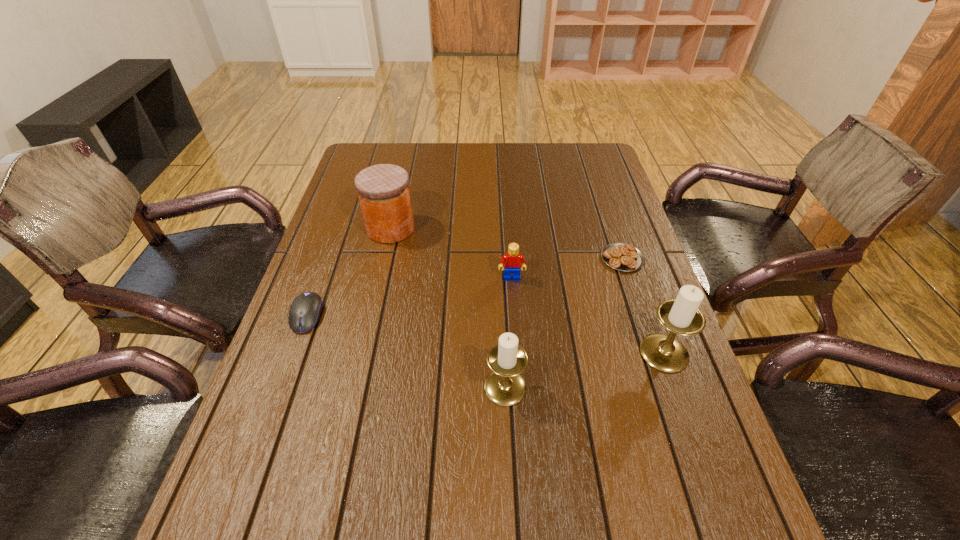
Identify the location of pastry that is at the right edge. Image resolution: width=960 pixels, height=540 pixels. (621, 256).

In the image, there is a desktop. Identify the location of vacant space at the far edge. The width and height of the screenshot is (960, 540). (527, 172).

Find the location of a particular element. This screenshot has width=960, height=540. free space at the left edge of the desktop is located at coordinates (355, 300).

Where is `vacant position at the right edge of the desktop`? The height and width of the screenshot is (540, 960). vacant position at the right edge of the desktop is located at coordinates (613, 360).

Locate an element on the screen. vacant space at the far right corner of the desktop is located at coordinates (582, 151).

Locate an element on the screen. vacant region between the fifth tallest object and the right candle holder is located at coordinates (486, 334).

You are a GUI agent. You are given a task and a screenshot of the screen. Output one action in this format:
    pyautogui.click(x=<x>, y=<y>)
    Task: Click on the vacant area that lies between the taller candle holder and the shortest object
    
    Given the screenshot: What is the action you would take?
    pyautogui.click(x=643, y=306)

Find the location of a particular element. vacant region between the Lego and the tallest object is located at coordinates (588, 315).

The height and width of the screenshot is (540, 960). In order to click on free space between the second object from left to right and the Lego in this screenshot , I will do `click(451, 253)`.

At what (x,y) coordinates should I click in order to perform the action: click on unoccupied area between the fifth tallest object and the shortest object. Please return your answer as a coordinate pair (x, y). The height and width of the screenshot is (540, 960). Looking at the image, I should click on (465, 287).